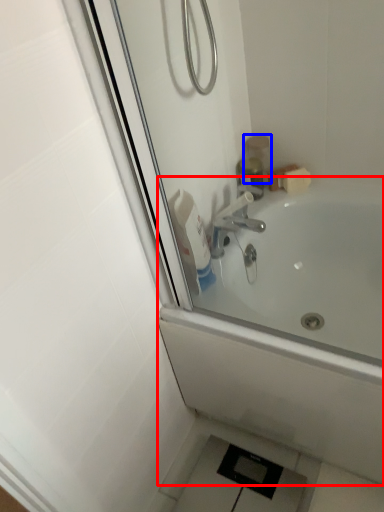
Question: Which object appears farthest to the camera in this image, bathtub (highlighted by a red box) or toiletry (highlighted by a blue box)?

Choices:
 (A) bathtub
 (B) toiletry

Answer: (B)